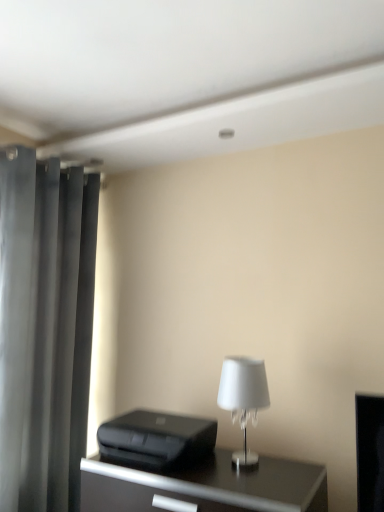
The height and width of the screenshot is (512, 384). In order to click on black glossy table at center in this screenshot , I will do `click(206, 487)`.

What do you see at coordinates (206, 487) in the screenshot? This screenshot has height=512, width=384. I see `black glossy table at center` at bounding box center [206, 487].

Locate an element on the screen. This screenshot has width=384, height=512. black plastic printer at lower center is located at coordinates (156, 440).

Between point (320, 506) and point (259, 365), which one is positioned in front?

The point (259, 365) is closer.

From the image's perspective, which object appears higher, black glossy table at center or white glass lamp at center?

white glass lamp at center.

Which is more to the right, black glossy table at center or white glass lamp at center?

white glass lamp at center is more to the right.

How different are the orientations of black glossy table at center and white glass lamp at center in degrees?

1.54 degrees.

Considering the relative sizes of black plastic printer at lower center and black glossy table at center in the image provided, is black plastic printer at lower center thinner than black glossy table at center?

Yes, black plastic printer at lower center is thinner than black glossy table at center.

Is black plastic printer at lower center positioned before black glossy table at center?

No, the depth of black plastic printer at lower center is greater than that of black glossy table at center.

Where is `table below the black plastic printer at lower center (from a real-world perspective)`? This screenshot has height=512, width=384. table below the black plastic printer at lower center (from a real-world perspective) is located at coordinates (206, 487).

From the image's perspective, is black plastic printer at lower center above or below black glossy table at center?

Clearly, from the image's perspective, black plastic printer at lower center is above black glossy table at center.

Is white glass lamp at center bigger than dark gray matte curtain at left?

Answer: Incorrect, white glass lamp at center is not larger than dark gray matte curtain at left.

Does point (238, 409) appear closer or farther from the camera than point (79, 307)?

Point (238, 409) is positioned closer to the camera compared to point (79, 307).

Does white glass lamp at center have a lesser height compared to dark gray matte curtain at left?

Yes.

From the picture: From the image's perspective, between white glass lamp at center and dark gray matte curtain at left, which one is located above?

dark gray matte curtain at left appears higher in the image.

Is white glass lamp at center positioned with its back to black glossy table at center?

No, white glass lamp at center is not facing away from black glossy table at center.

Is white glass lamp at center spatially inside black glossy table at center, or outside of it?

white glass lamp at center lies outside black glossy table at center.

Is white glass lamp at center in front of black glossy table at center?

No, white glass lamp at center is behind black glossy table at center.

Considering the sizes of objects white glass lamp at center and black glossy table at center in the image provided, who is wider, white glass lamp at center or black glossy table at center?

black glossy table at center is wider.

Considering the positions of objects dark gray matte curtain at left and black plastic printer at lower center in the image provided, who is more to the left, dark gray matte curtain at left or black plastic printer at lower center?

dark gray matte curtain at left is more to the left.

Looking at their sizes, would you say dark gray matte curtain at left is wider or thinner than black plastic printer at lower center?

dark gray matte curtain at left is thinner than black plastic printer at lower center.

You are a GUI agent. You are given a task and a screenshot of the screen. Output one action in this format:
    pyautogui.click(x=<x>, y=<y>)
    Task: Click on the curtain above the black plastic printer at lower center (from a real-world perspective)
    The image size is (384, 512).
    Given the screenshot: What is the action you would take?
    pyautogui.click(x=44, y=328)

Who is smaller, black glossy table at center or black plastic printer at lower center?

With smaller size is black plastic printer at lower center.

Do you think black glossy table at center is within black plastic printer at lower center, or outside of it?

black glossy table at center is located beyond the bounds of black plastic printer at lower center.

From a real-world perspective, is black glossy table at center located beneath black plastic printer at lower center?

Yes, from a real-world perspective, black glossy table at center is under black plastic printer at lower center.

From their relative heights in the image, would you say black glossy table at center is taller or shorter than black plastic printer at lower center?

Clearly, black glossy table at center is taller compared to black plastic printer at lower center.

Is point (146, 432) farther from camera compared to point (17, 149)?

That is False.

How different are the orientations of black plastic printer at lower center and dark gray matte curtain at left in degrees?

88.5 degrees.

Does black plastic printer at lower center lie in front of dark gray matte curtain at left?

Yes, black plastic printer at lower center is closer to the viewer.

From the image's perspective, is black plastic printer at lower center over dark gray matte curtain at left?

Actually, black plastic printer at lower center appears below dark gray matte curtain at left in the image.

Where is `lamp on the right of black glossy table at center`? lamp on the right of black glossy table at center is located at coordinates (243, 399).

This screenshot has width=384, height=512. Identify the location of printer lying above the black glossy table at center (from the image's perspective). (156, 440).

From the image, which object appears to be farther from white glass lamp at center, black plastic printer at lower center or dark gray matte curtain at left?

dark gray matte curtain at left is further to white glass lamp at center.

From the image, which object appears to be nearer to dark gray matte curtain at left, black glossy table at center or black plastic printer at lower center?

The object closer to dark gray matte curtain at left is black plastic printer at lower center.

When comparing their distances from black glossy table at center, does white glass lamp at center or black plastic printer at lower center seem closer?

black plastic printer at lower center.

Looking at the image, which one is located closer to dark gray matte curtain at left, black glossy table at center or white glass lamp at center?

black glossy table at center is positioned closer to the anchor dark gray matte curtain at left.

When comparing their distances from dark gray matte curtain at left, does white glass lamp at center or black glossy table at center seem further?

white glass lamp at center is further to dark gray matte curtain at left.

From the image, which object appears to be farther from black glossy table at center, dark gray matte curtain at left or black plastic printer at lower center?

The object further to black glossy table at center is dark gray matte curtain at left.

When comparing their distances from white glass lamp at center, does black glossy table at center or black plastic printer at lower center seem closer?

The object closer to white glass lamp at center is black glossy table at center.

Considering their positions, is dark gray matte curtain at left positioned closer to black plastic printer at lower center than white glass lamp at center?

white glass lamp at center is positioned closer to the anchor black plastic printer at lower center.

Where is `table between dark gray matte curtain at left and white glass lamp at center in the horizontal direction`? The width and height of the screenshot is (384, 512). table between dark gray matte curtain at left and white glass lamp at center in the horizontal direction is located at coordinates (206, 487).

Identify the location of printer between white glass lamp at center and black glossy table at center vertically. (156, 440).

Locate an element on the screen. The height and width of the screenshot is (512, 384). printer located between dark gray matte curtain at left and black glossy table at center in the left-right direction is located at coordinates (156, 440).

Where is `printer between dark gray matte curtain at left and white glass lamp at center from left to right`? printer between dark gray matte curtain at left and white glass lamp at center from left to right is located at coordinates 156,440.